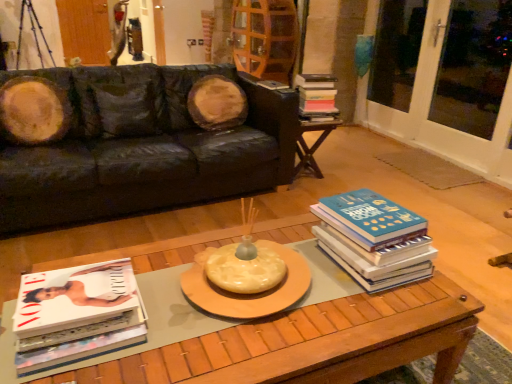
Where is `vacant area on top of wooden coffee table at center (from a real-world perspective)`? vacant area on top of wooden coffee table at center (from a real-world perspective) is located at coordinates (241, 300).